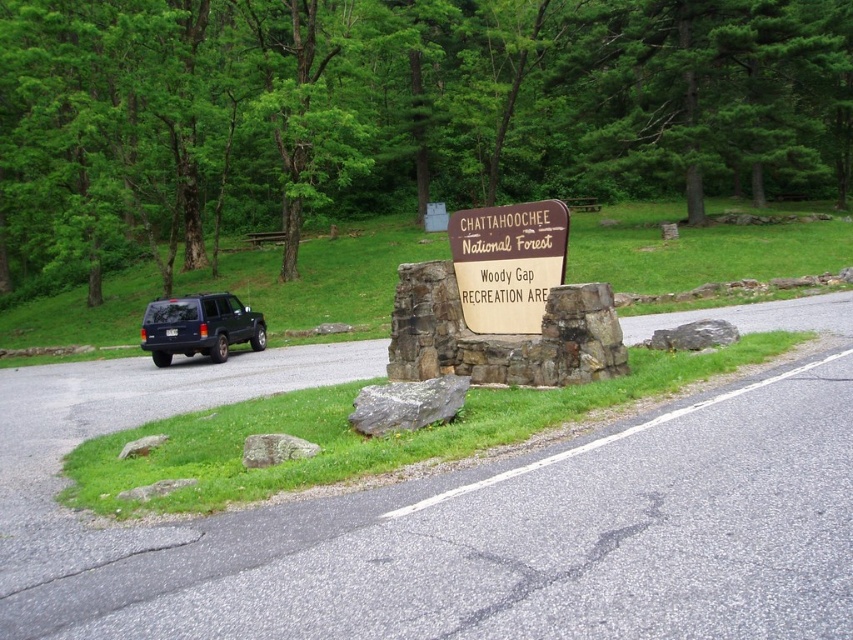
Can you confirm if gray rock at lower center is bigger than gray rough rock at lower left?

Indeed, gray rock at lower center has a larger size compared to gray rough rock at lower left.

Is gray rock at lower center below gray rough rock at lower left?

Incorrect, gray rock at lower center is not positioned below gray rough rock at lower left.

Locate an element on the screen. The height and width of the screenshot is (640, 853). gray rock at lower center is located at coordinates (276, 449).

Find the location of a particular element. The width and height of the screenshot is (853, 640). gray rock at lower center is located at coordinates pyautogui.click(x=276, y=449).

Does point (148, 323) come in front of point (364, 401)?

No, it is behind (364, 401).

Based on the photo, is matte blue suv at left below gray rough rock at center?

Incorrect, matte blue suv at left is not positioned below gray rough rock at center.

Find the location of a particular element. The height and width of the screenshot is (640, 853). matte blue suv at left is located at coordinates (199, 326).

Who is more distant from viewer, [711,321] or [155,442]?

The point [711,321] is more distant.

Locate an element on the screen. The image size is (853, 640). gray rock at lower right is located at coordinates (694, 336).